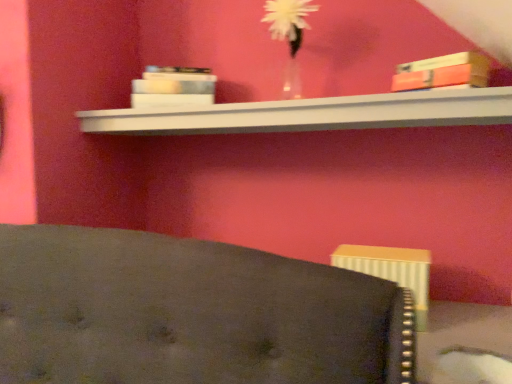
Question: In the image, is white matte book at upper center, arranged as the 2th book when viewed from the front, on the left side or the right side of white glossy shelf at upper center?

Choices:
 (A) left
 (B) right

Answer: (A)

Question: Considering the positions of point (174, 66) and point (315, 119), is point (174, 66) closer or farther from the camera than point (315, 119)?

Choices:
 (A) farther
 (B) closer

Answer: (A)

Question: Estimate the real-world distances between objects in this image. Which object is farther from the matte orange book at upper right, which is counted as the 1th book, starting from the front?

Choices:
 (A) translucent glass vase at upper center
 (B) white matte book at upper center, which is the 2th book from right to left
 (C) white glossy shelf at upper center

Answer: (B)

Question: Estimate the real-world distances between objects in this image. Which object is farther from the translucent glass vase at upper center?

Choices:
 (A) matte orange book at upper right, which is the second book in left-to-right order
 (B) white matte book at upper center, which is the 2th book from right to left
 (C) white glossy shelf at upper center

Answer: (A)